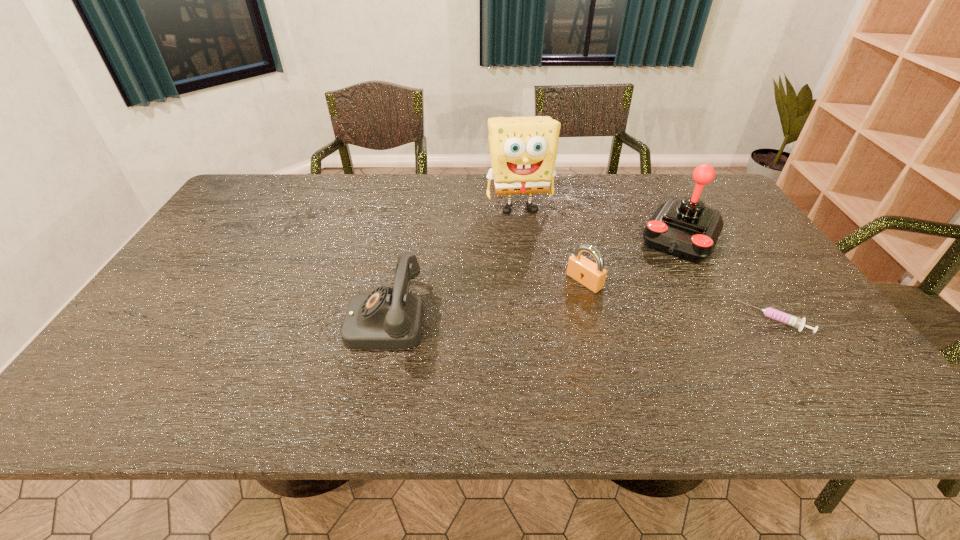
What are the coordinates of `free space at the near right corner of the desktop` in the screenshot? It's located at (804, 361).

You are a GUI agent. You are given a task and a screenshot of the screen. Output one action in this format:
    pyautogui.click(x=<x>, y=<y>)
    Task: Click on the free space between the tallest object and the third shortest object
    
    Given the screenshot: What is the action you would take?
    pyautogui.click(x=453, y=263)

The width and height of the screenshot is (960, 540). In order to click on free space between the second tallest object and the shortest object in this screenshot , I will do `click(728, 278)`.

What are the coordinates of `free point between the syringe and the sponge` in the screenshot? It's located at point(647,263).

Where is `free spot between the telephone and the fourth shortest object`? The height and width of the screenshot is (540, 960). free spot between the telephone and the fourth shortest object is located at coordinates (534, 278).

Image resolution: width=960 pixels, height=540 pixels. Identify the location of free space between the padlock and the joystick. (633, 259).

At what (x,y) coordinates should I click in order to perform the action: click on free space that is in between the joystick and the sponge. Please return your answer as a coordinate pair (x, y). Looking at the image, I should click on (600, 221).

The image size is (960, 540). Identify the location of free space between the leftmost object and the padlock. (485, 300).

This screenshot has width=960, height=540. What are the coordinates of `free spot between the padlock and the syringe` in the screenshot? It's located at (679, 300).

This screenshot has width=960, height=540. What are the coordinates of `vacant space in between the padlock and the shortest object` in the screenshot? It's located at (679, 300).